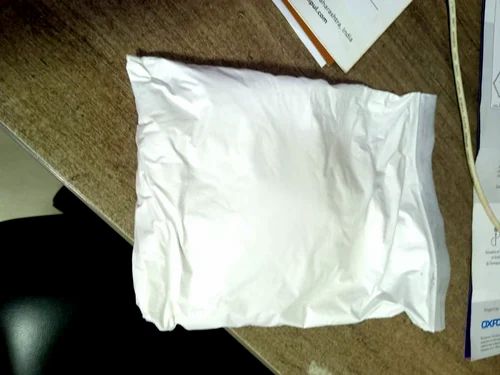
The width and height of the screenshot is (500, 375). What are the coordinates of `pillow` in the screenshot? It's located at (280, 202).